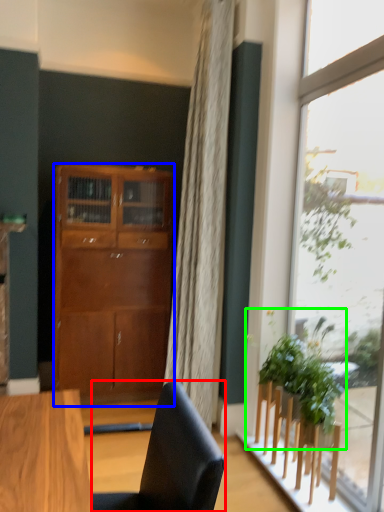
Question: Considering the real-world distances, which object is farthest from chair (highlighted by a red box)? cabinetry (highlighted by a blue box) or houseplant (highlighted by a green box)?

Choices:
 (A) cabinetry
 (B) houseplant

Answer: (A)